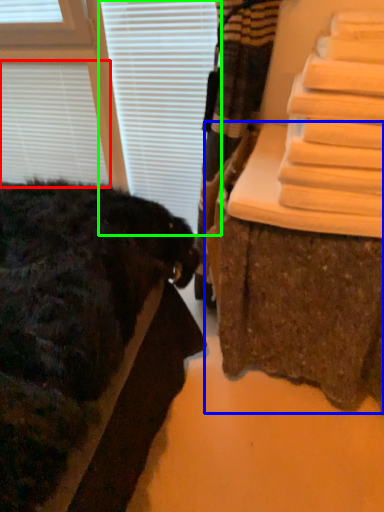
Question: Which object is positioned farthest from blind (highlighted by a red box)? Select from furniture (highlighted by a blue box) and blind (highlighted by a green box).

Choices:
 (A) furniture
 (B) blind

Answer: (A)